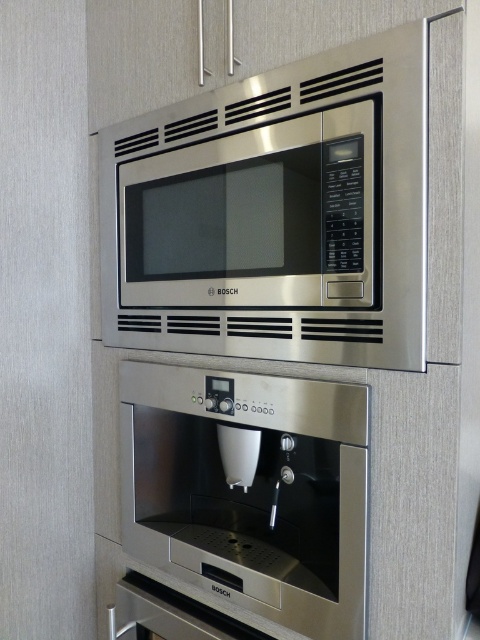
Does stainless steel microwave at upper center lie in front of stainless steel coffee machine at center?

Yes, stainless steel microwave at upper center is closer to the viewer.

Which is above, stainless steel microwave at upper center or stainless steel coffee machine at center?

Positioned higher is stainless steel microwave at upper center.

Is point (276, 280) in front of point (272, 424)?

Yes, point (276, 280) is closer to viewer.

Image resolution: width=480 pixels, height=640 pixels. Find the location of `stainless steel microwave at upper center`. stainless steel microwave at upper center is located at coordinates (276, 212).